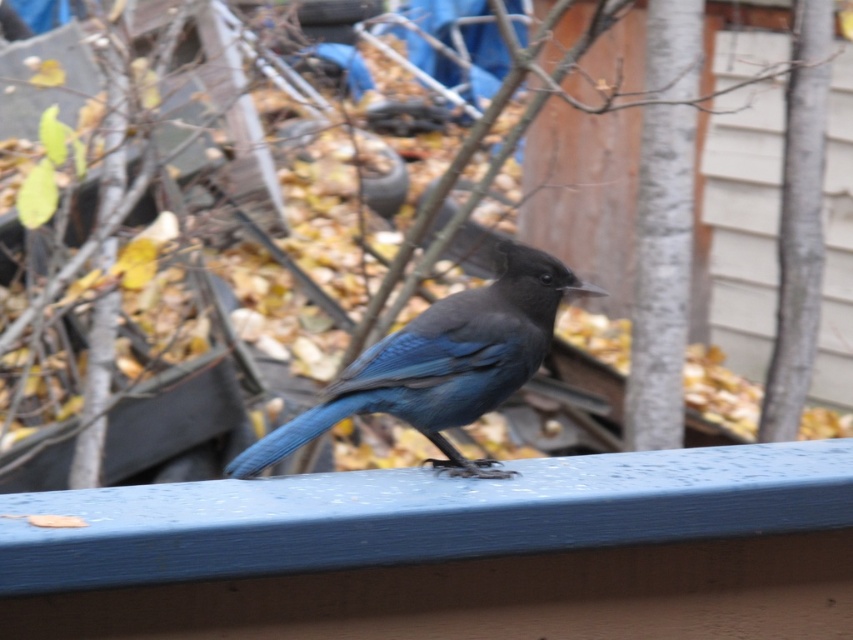
Is point (688, 612) less distant than point (480, 296)?

Yes, it is in front of point (480, 296).

Between point (94, 525) and point (445, 464), which one is positioned in front?

Point (94, 525)

The width and height of the screenshot is (853, 640). I want to click on blue painted wood at center, so click(x=453, y=552).

Image resolution: width=853 pixels, height=640 pixels. I want to click on blue painted wood at center, so click(453, 552).